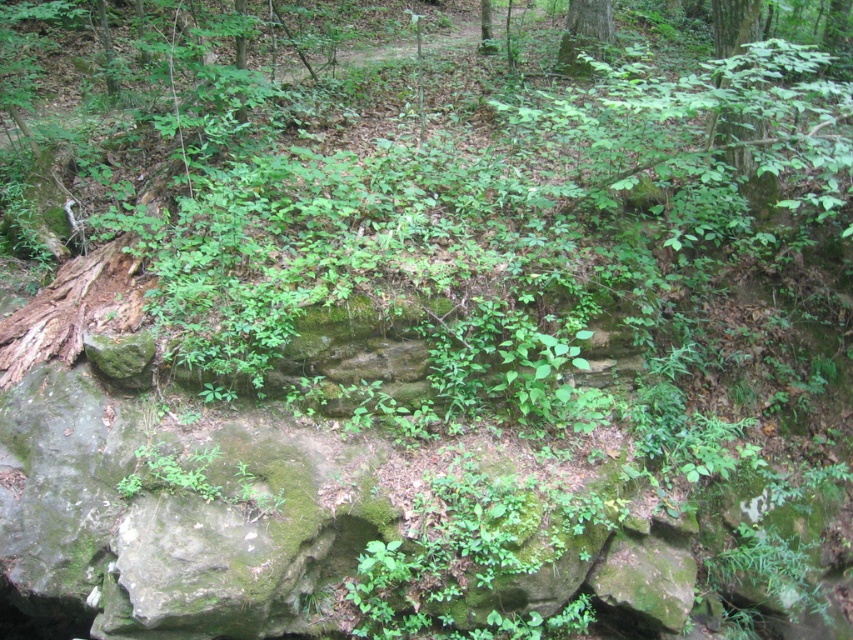
Question: Is the position of green leafy tree at upper right more distant than that of green leafy tree at center?

Choices:
 (A) no
 (B) yes

Answer: (A)

Question: Does green leafy tree at upper right lie in front of green leafy tree at center?

Choices:
 (A) no
 (B) yes

Answer: (B)

Question: Which object is the closest to the green leafy tree at upper right?

Choices:
 (A) green mossy tree at upper center
 (B) green leafy tree at center

Answer: (A)

Question: Which point is closer to the camera taking this photo?

Choices:
 (A) (585, 22)
 (B) (480, 26)

Answer: (A)

Question: Which point is farther to the camera?

Choices:
 (A) (x=567, y=10)
 (B) (x=755, y=10)

Answer: (A)

Question: Is green mossy tree at upper center to the left of green leafy tree at center from the viewer's perspective?

Choices:
 (A) yes
 (B) no

Answer: (B)